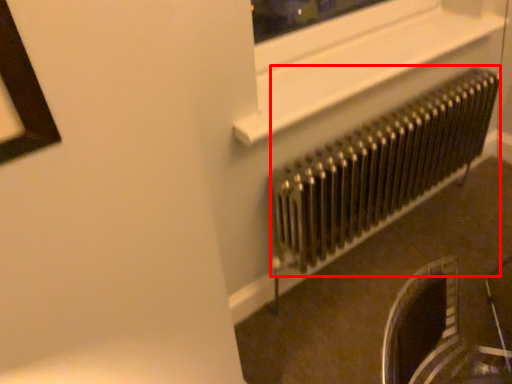
Question: From the image, what is the correct spatial relationship of radiator (annotated by the red box) in relation to window frame?

Choices:
 (A) left
 (B) right

Answer: (B)